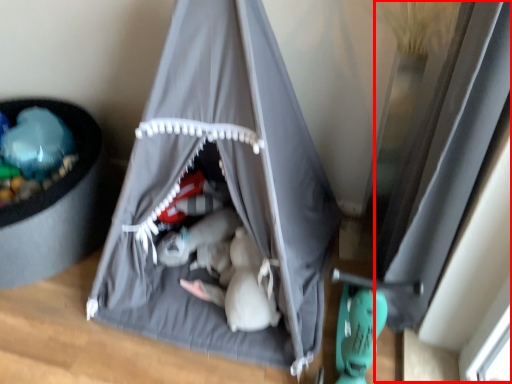
Question: In this image, where is window (annotated by the red box) located relative to tent?

Choices:
 (A) left
 (B) right

Answer: (B)